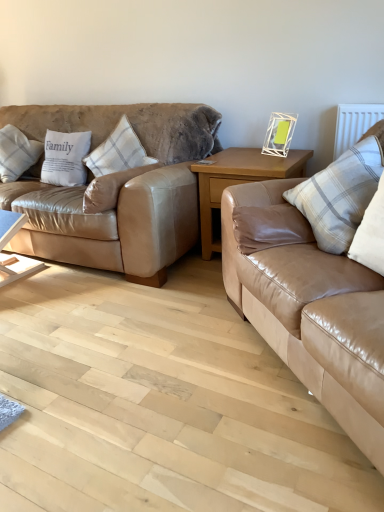
Question: In terms of width, does white plastic picture frame at upper right look wider or thinner when compared to white plaid pillow at left, the 4th pillow in the left-to-right sequence?

Choices:
 (A) wide
 (B) thin

Answer: (B)

Question: From a real-world perspective, is white plastic picture frame at upper right physically located above or below white plaid pillow at left, the 4th pillow in the left-to-right sequence?

Choices:
 (A) above
 (B) below

Answer: (A)

Question: Which object is the closest to the white textured radiator at upper right?

Choices:
 (A) white cotton pillow at left, arranged as the 4th pillow when viewed from the right
 (B) white plaid pillow at left, positioned as the second pillow in right-to-left order
 (C) light wood table at lower left, which ranks as the 2th table in right-to-left order
 (D) tan leather couch at right, marked as the 2th studio couch in a left-to-right arrangement
 (E) matte leather couch at left, which is the first studio couch from left to right

Answer: (D)

Question: Which object is positioned farthest from the white plaid pillow at left, the 4th pillow in the left-to-right sequence?

Choices:
 (A) white plastic picture frame at upper right
 (B) white cotton pillow at left, acting as the 2th pillow starting from the left
 (C) matte leather couch at left, the 2th studio couch in the right-to-left sequence
 (D) tan leather couch at right, the first studio couch positioned from the right
 (E) white textured radiator at upper right

Answer: (E)